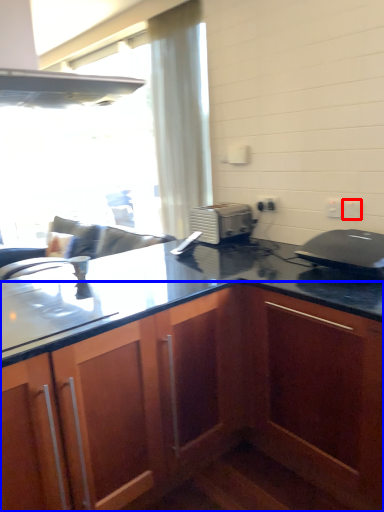
Question: Which object is further to the camera taking this photo, electric outlet (highlighted by a red box) or cabinetry (highlighted by a blue box)?

Choices:
 (A) electric outlet
 (B) cabinetry

Answer: (A)